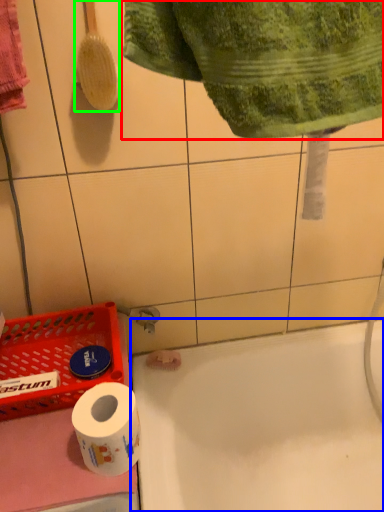
Question: Based on their relative distances, which object is farther from towel (highlighted by a red box)? Choose from bath (highlighted by a blue box) and brush (highlighted by a green box).

Choices:
 (A) bath
 (B) brush

Answer: (A)